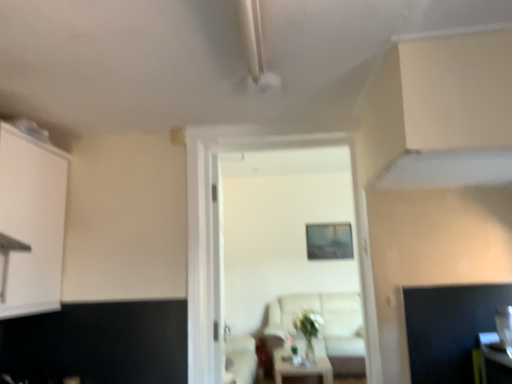
Question: From the image's perspective, is transparent glass door at center on top of white glossy table at center?

Choices:
 (A) no
 (B) yes

Answer: (B)

Question: Is transparent glass door at center not within white glossy table at center?

Choices:
 (A) no
 (B) yes

Answer: (B)

Question: Does transparent glass door at center have a greater width compared to white glossy table at center?

Choices:
 (A) yes
 (B) no

Answer: (B)

Question: From a real-world perspective, does transparent glass door at center stand above white glossy table at center?

Choices:
 (A) yes
 (B) no

Answer: (A)

Question: Is transparent glass door at center with white glossy table at center?

Choices:
 (A) yes
 (B) no

Answer: (B)

Question: Can you confirm if transparent glass door at center is smaller than white glossy table at center?

Choices:
 (A) no
 (B) yes

Answer: (A)

Question: Could you tell me if transparent glass door at center is turned towards white wooden door at center?

Choices:
 (A) no
 (B) yes

Answer: (A)

Question: From a real-world perspective, is transparent glass door at center located higher than white wooden door at center?

Choices:
 (A) no
 (B) yes

Answer: (A)

Question: From the image's perspective, is transparent glass door at center located above white wooden door at center?

Choices:
 (A) no
 (B) yes

Answer: (A)

Question: Does transparent glass door at center have a smaller size compared to white wooden door at center?

Choices:
 (A) yes
 (B) no

Answer: (A)

Question: Considering the relative positions of transparent glass door at center and white wooden door at center in the image provided, is transparent glass door at center in front of white wooden door at center?

Choices:
 (A) no
 (B) yes

Answer: (A)

Question: Is transparent glass door at center not close to white wooden door at center?

Choices:
 (A) no
 (B) yes

Answer: (A)

Question: Does white matte cabinet at left have a greater width compared to beige fabric couch at center?

Choices:
 (A) no
 (B) yes

Answer: (A)